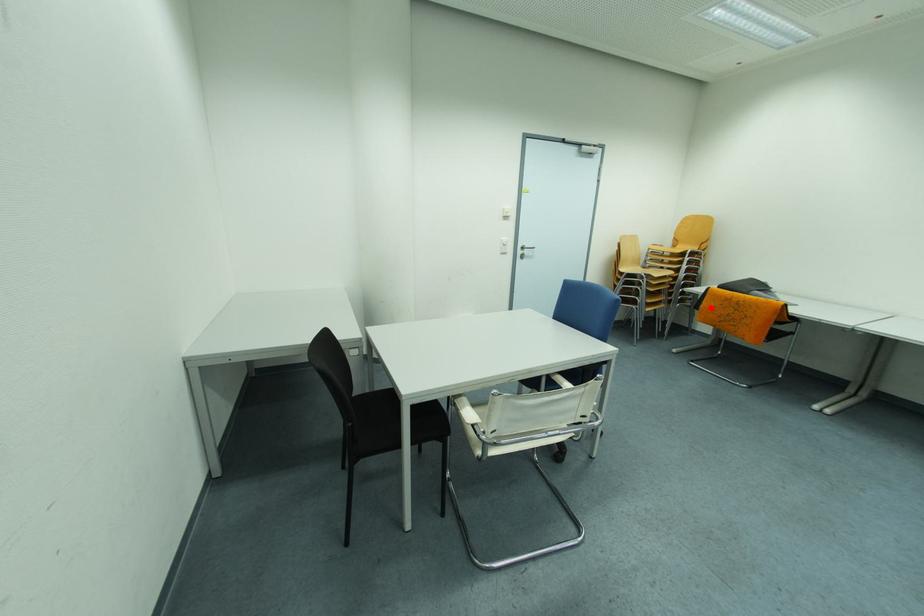
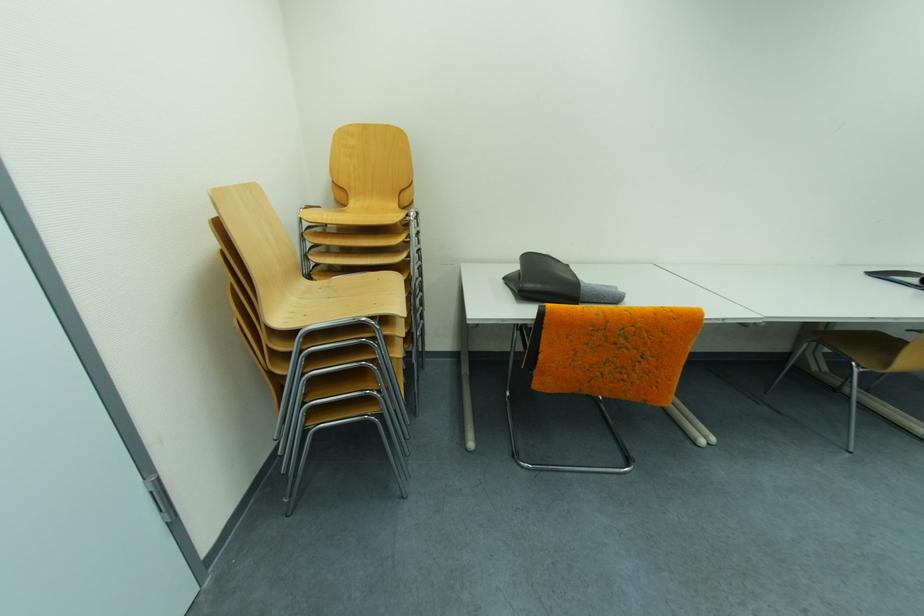
Question: I am providing you with two images of the same scene from different viewpoints. Given a red point in image1, look at the same physical point in image2. Is it:

Choices:
 (A) Closer to the viewpoint
 (B) Farther from the viewpoint

Answer: (B)